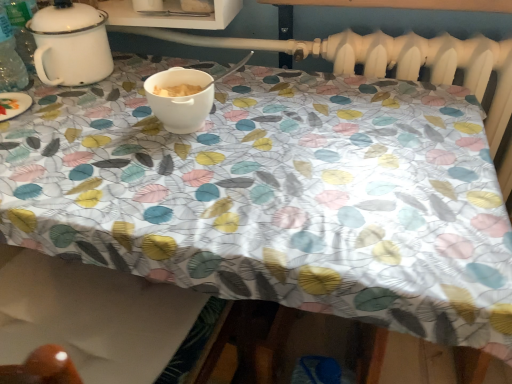
Question: From a real-world perspective, is white enamel pot at upper left positioned above or below white matte bowl at center?

Choices:
 (A) above
 (B) below

Answer: (A)

Question: Looking at their shapes, would you say white enamel pot at upper left is wider or thinner than white matte bowl at center?

Choices:
 (A) wide
 (B) thin

Answer: (A)

Question: Based on their sizes in the image, would you say white enamel pot at upper left is bigger or smaller than white matte bowl at center?

Choices:
 (A) big
 (B) small

Answer: (A)

Question: Looking at their shapes, would you say white matte bowl at center is wider or thinner than white enamel pot at upper left?

Choices:
 (A) wide
 (B) thin

Answer: (B)

Question: Based on their sizes in the image, would you say white matte bowl at center is bigger or smaller than white enamel pot at upper left?

Choices:
 (A) big
 (B) small

Answer: (B)

Question: Is point coord(203,107) closer or farther from the camera than point coord(83,34)?

Choices:
 (A) farther
 (B) closer

Answer: (B)

Question: From the image's perspective, is white matte bowl at center positioned above or below white enamel pot at upper left?

Choices:
 (A) below
 (B) above

Answer: (A)